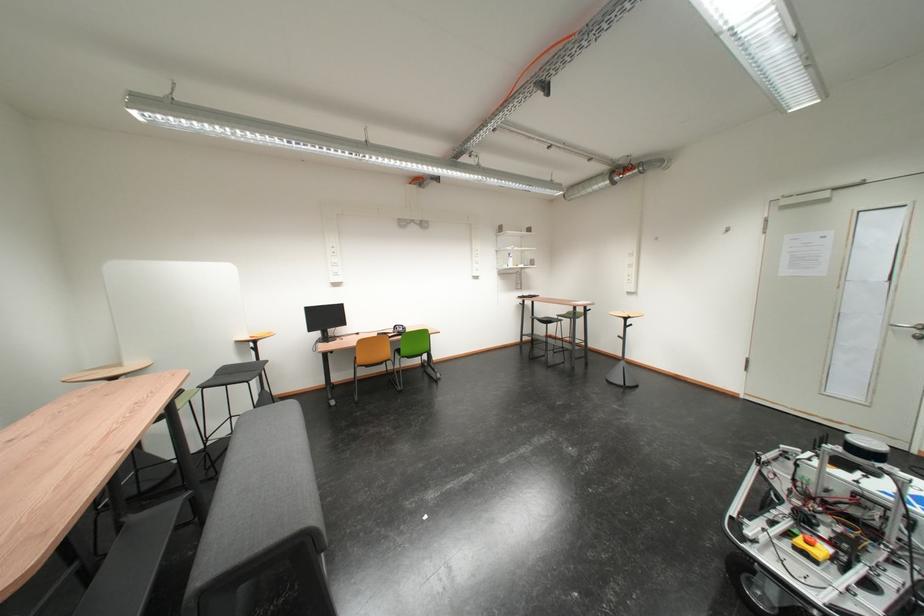
What do you see at coordinates (546, 320) in the screenshot?
I see `the green chair surface` at bounding box center [546, 320].